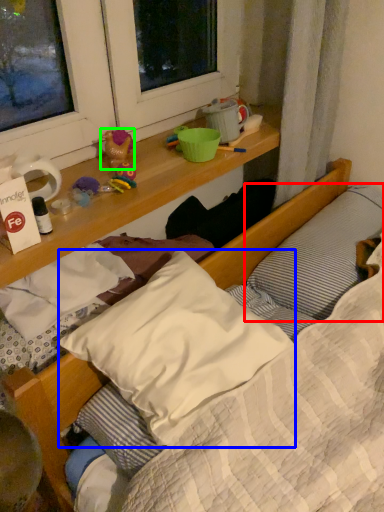
Question: Considering the real-world distances, which object is closest to pillow (highlighted by a red box)? pillow (highlighted by a blue box) or toy (highlighted by a green box).

Choices:
 (A) pillow
 (B) toy

Answer: (A)